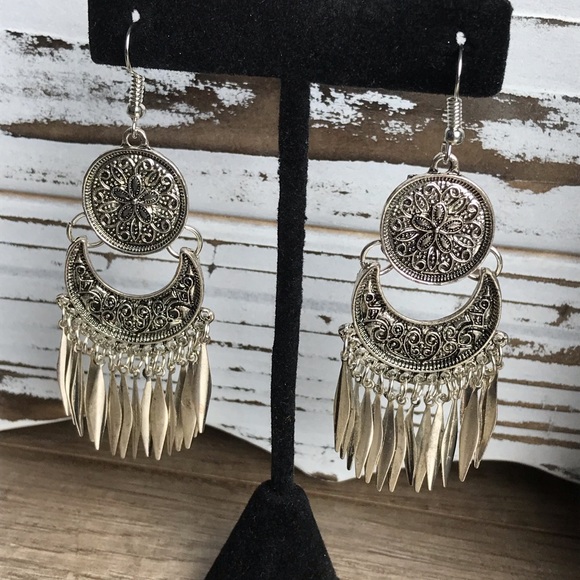
Identify the location of stand. (293, 256).